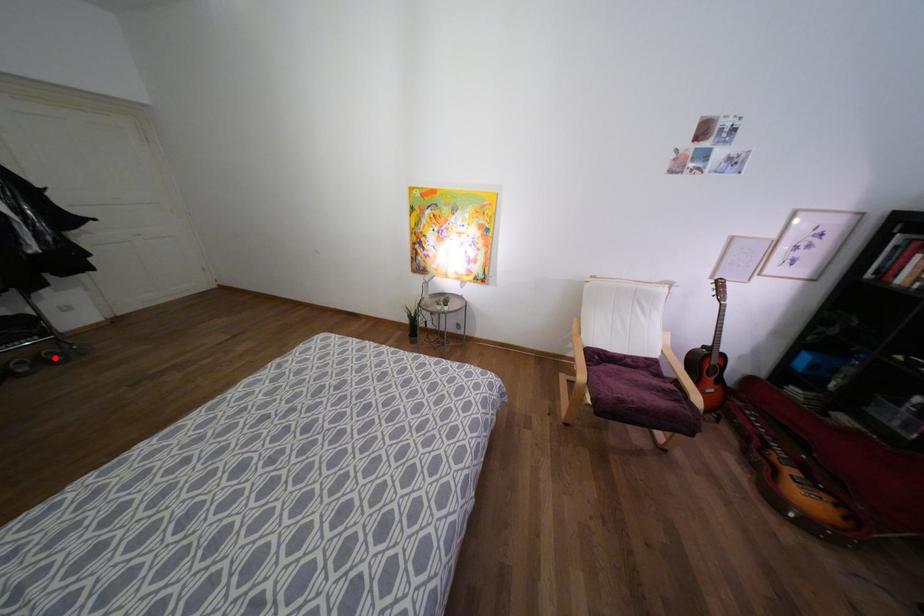
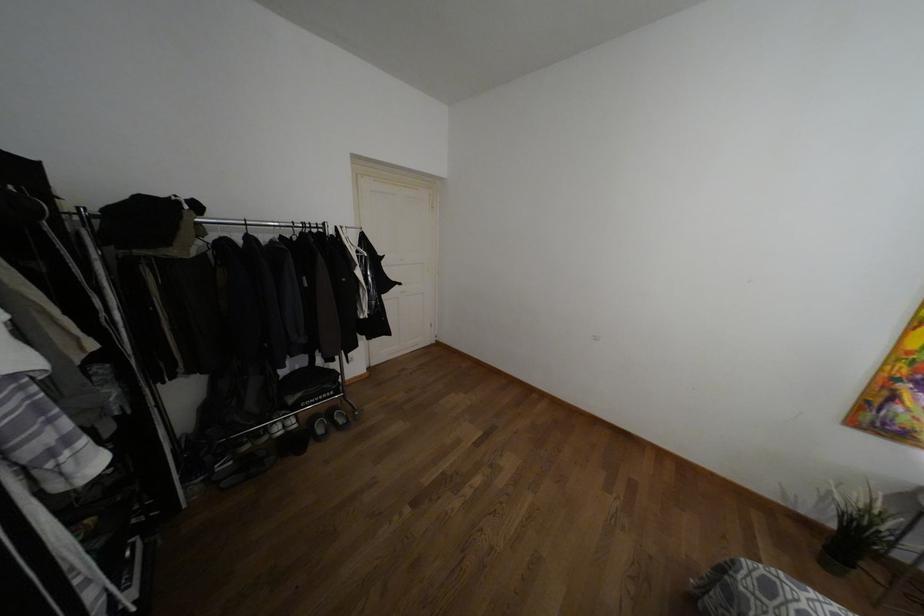
Where in the second image is the point corresponding to the highlighted location from the first image?

(341, 419)